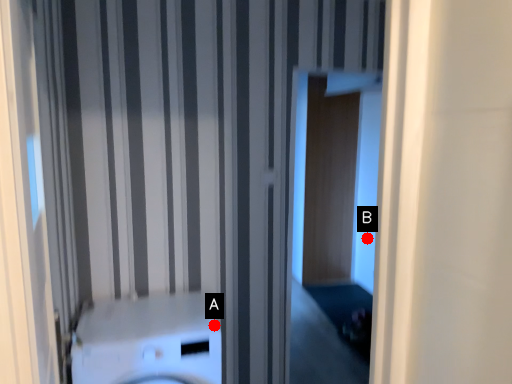
Question: Two points are circled on the image, labeled by A and B beside each circle. Which point is closer to the camera taking this photo?

Choices:
 (A) A is closer
 (B) B is closer

Answer: (A)